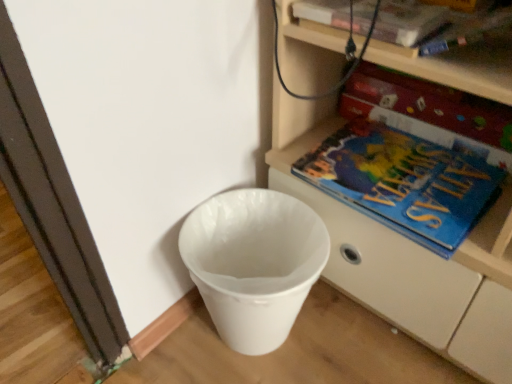
Question: Can you confirm if blue matte paperback book at right, which ranks as the 2th paperback book in top-to-bottom order, is taller than blue matte atlas at lower right?

Choices:
 (A) yes
 (B) no

Answer: (A)

Question: Does blue matte paperback book at right, which is the first paperback book in bottom-to-top order, have a larger size compared to blue matte atlas at lower right?

Choices:
 (A) yes
 (B) no

Answer: (B)

Question: Is blue matte paperback book at right, which ranks as the 2th paperback book in top-to-bottom order, at the left side of blue matte atlas at lower right?

Choices:
 (A) no
 (B) yes

Answer: (A)

Question: From a real-world perspective, is blue matte paperback book at right, the 1th paperback book viewed from the back, located beneath blue matte atlas at lower right?

Choices:
 (A) yes
 (B) no

Answer: (B)

Question: Is blue matte paperback book at right, the 1th paperback book viewed from the back, positioned behind blue matte atlas at lower right?

Choices:
 (A) yes
 (B) no

Answer: (A)

Question: Is blue matte paperback book at right, which ranks as the 2th paperback book in top-to-bottom order, to the right of blue matte atlas at lower right from the viewer's perspective?

Choices:
 (A) yes
 (B) no

Answer: (A)

Question: From the image's perspective, does hardcover book at upper center, the 2th paperback book positioned from the bottom, appear higher than white plastic shelf at lower right?

Choices:
 (A) no
 (B) yes

Answer: (B)

Question: Considering the relative sizes of hardcover book at upper center, positioned as the first paperback book in front-to-back order, and white plastic shelf at lower right in the image provided, is hardcover book at upper center, positioned as the first paperback book in front-to-back order, taller than white plastic shelf at lower right?

Choices:
 (A) yes
 (B) no

Answer: (B)

Question: Does hardcover book at upper center, positioned as the first paperback book in front-to-back order, have a lesser width compared to white plastic shelf at lower right?

Choices:
 (A) no
 (B) yes

Answer: (B)

Question: Is hardcover book at upper center, the 2th paperback book positioned from the bottom, located outside white plastic shelf at lower right?

Choices:
 (A) no
 (B) yes

Answer: (A)

Question: From a real-world perspective, is hardcover book at upper center, positioned as the first paperback book in front-to-back order, over white plastic shelf at lower right?

Choices:
 (A) no
 (B) yes

Answer: (B)

Question: Considering the relative sizes of hardcover book at upper center, the 2th paperback book positioned from the bottom, and white plastic shelf at lower right in the image provided, is hardcover book at upper center, the 2th paperback book positioned from the bottom, smaller than white plastic shelf at lower right?

Choices:
 (A) yes
 (B) no

Answer: (A)

Question: Is white plastic waste bin at lower left further to the viewer compared to blue matte atlas at lower right?

Choices:
 (A) yes
 (B) no

Answer: (B)